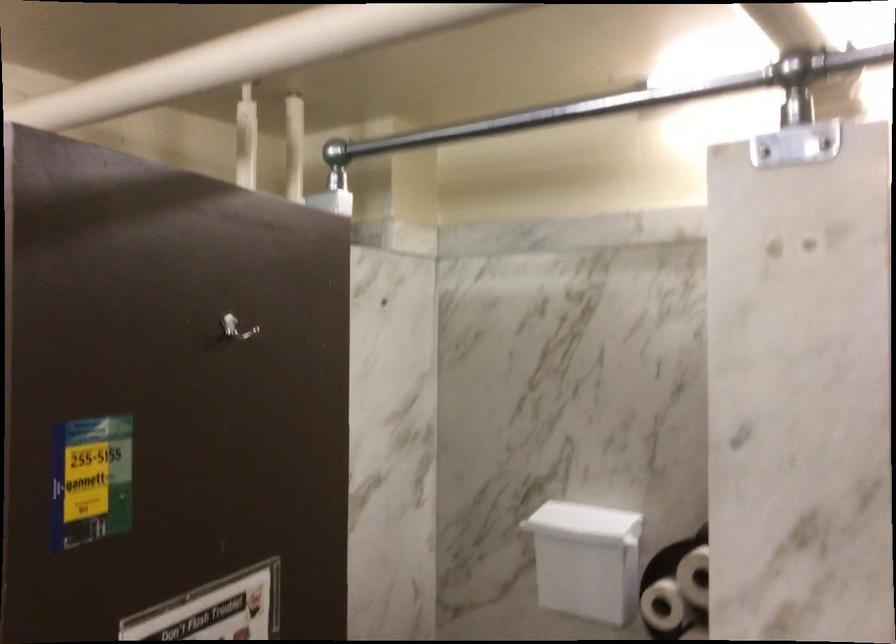
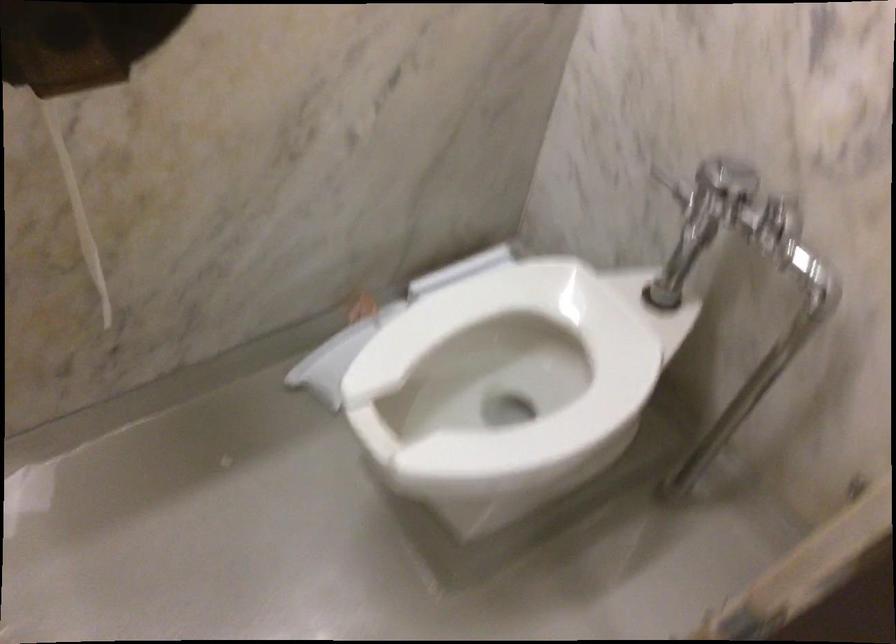
How did the camera likely rotate?

The camera's rotation is toward right-down.